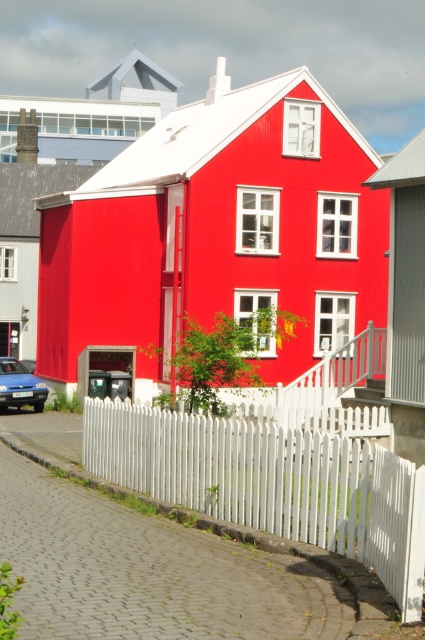
Question: Does white picket fence at lower center have a lesser width compared to matte blue car at lower left?

Choices:
 (A) yes
 (B) no

Answer: (B)

Question: Which point is farther to the camera?

Choices:
 (A) (282, 536)
 (B) (11, 371)

Answer: (B)

Question: Is white picket fence at lower center to the left of matte blue car at lower left from the viewer's perspective?

Choices:
 (A) yes
 (B) no

Answer: (B)

Question: Which of the following is the farthest from the observer?

Choices:
 (A) (11, 371)
 (B) (394, 538)

Answer: (A)

Question: Can you confirm if white picket fence at lower center is positioned above matte blue car at lower left?

Choices:
 (A) yes
 (B) no

Answer: (A)

Question: Which point is farther to the camera?

Choices:
 (A) matte blue car at lower left
 (B) white picket fence at lower center

Answer: (A)